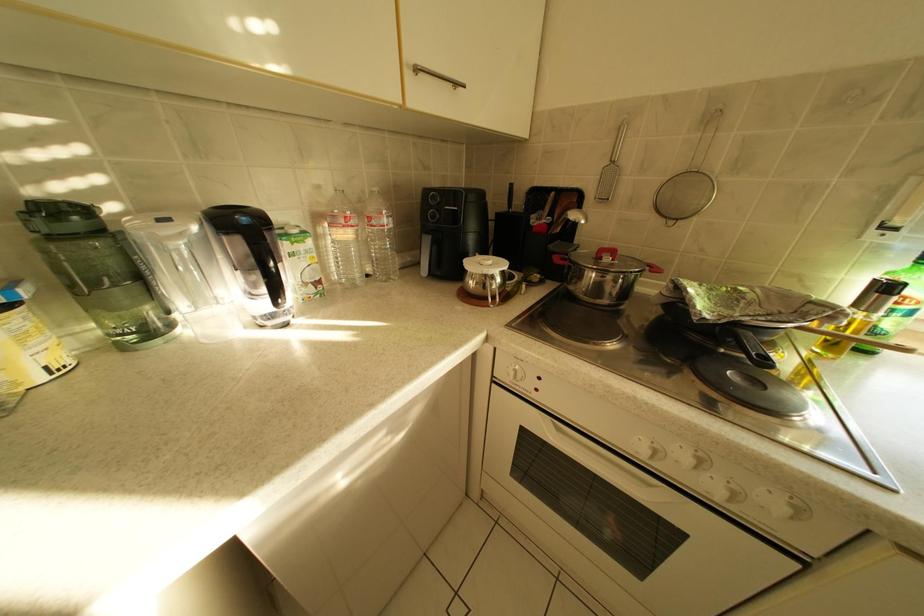
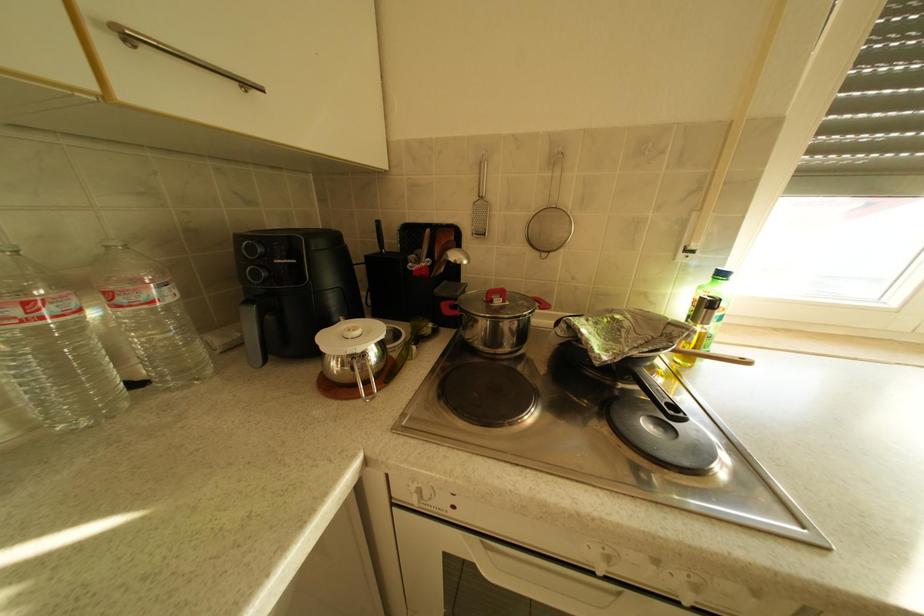
In a continuous first-person perspective shot, in which direction is the camera moving?

The cameraman walked toward right, forward.